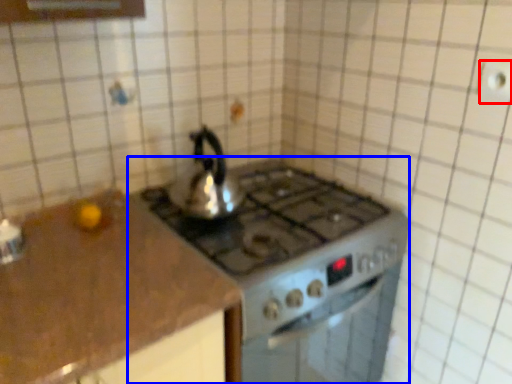
Question: Among these objects, which one is farthest to the camera, electric outlet (highlighted by a red box) or gas stove (highlighted by a blue box)?

Choices:
 (A) electric outlet
 (B) gas stove

Answer: (B)